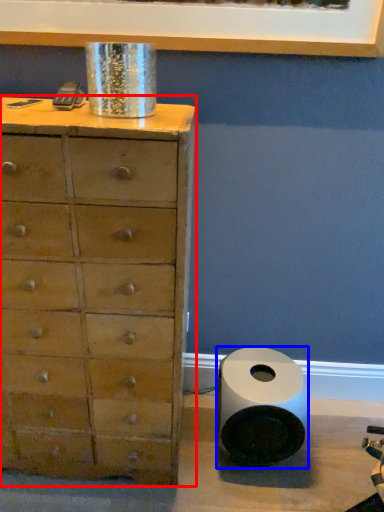
Question: Which point is further to the camera, chest of drawers (highlighted by a red box) or speaker (highlighted by a blue box)?

Choices:
 (A) chest of drawers
 (B) speaker

Answer: (B)